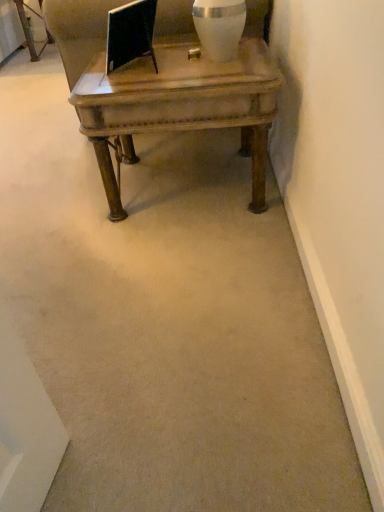
You are a GUI agent. You are given a task and a screenshot of the screen. Output one action in this format:
    pyautogui.click(x=<x>, y=<y>)
    Task: Click on the free space in front of white glossy vase at upper center
    The width and height of the screenshot is (384, 512).
    Given the screenshot: What is the action you would take?
    pyautogui.click(x=220, y=74)